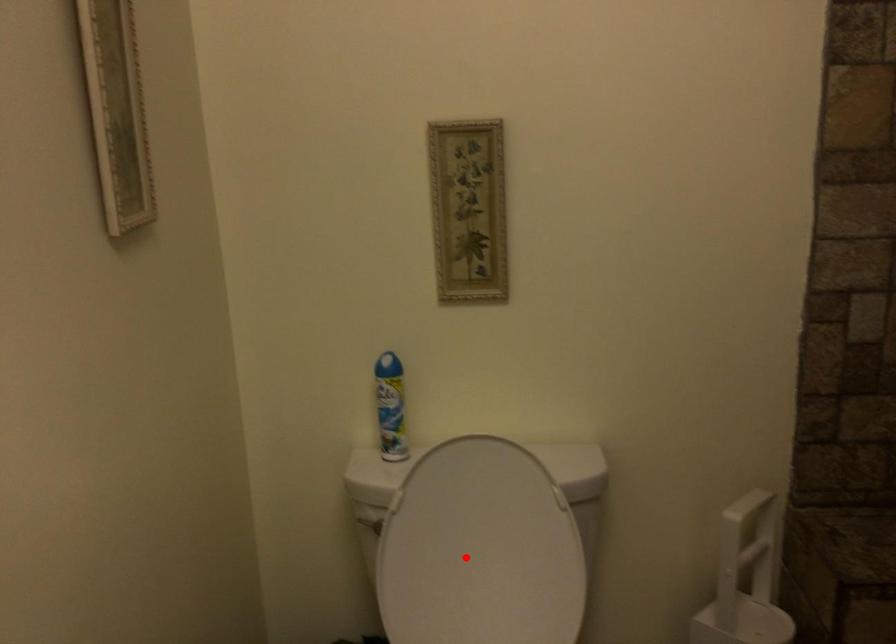
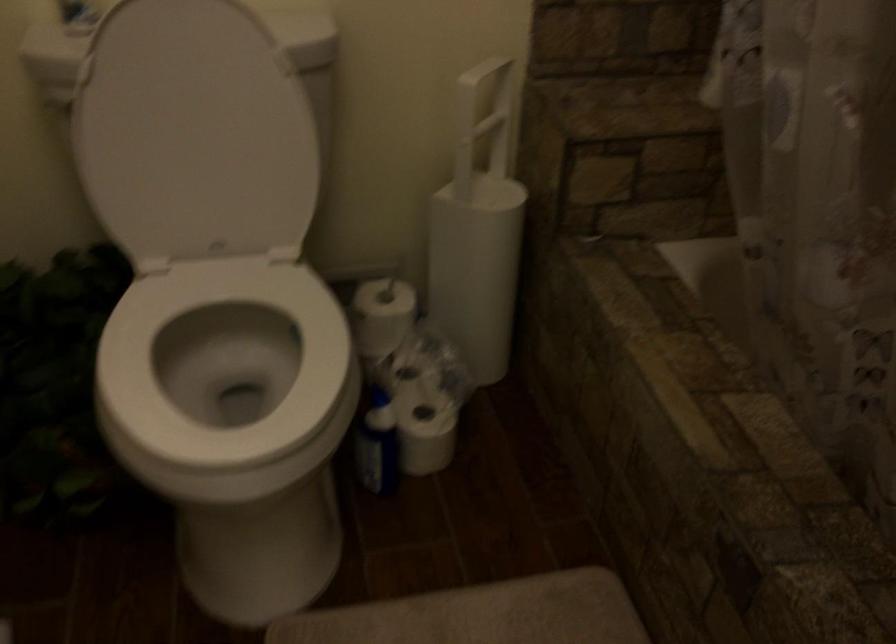
Find the pixel in the second image that matches the highlighted location in the first image.

(194, 134)